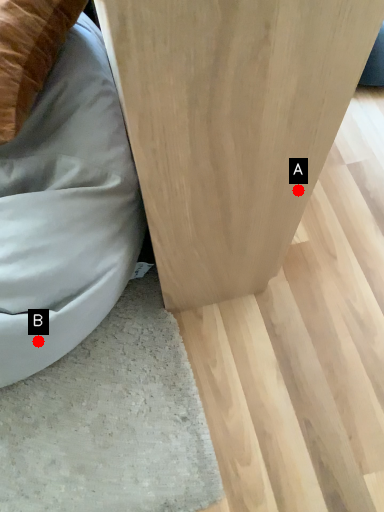
Question: Two points are circled on the image, labeled by A and B beside each circle. Which point is farther from the camera taking this photo?

Choices:
 (A) A is further
 (B) B is further

Answer: (B)